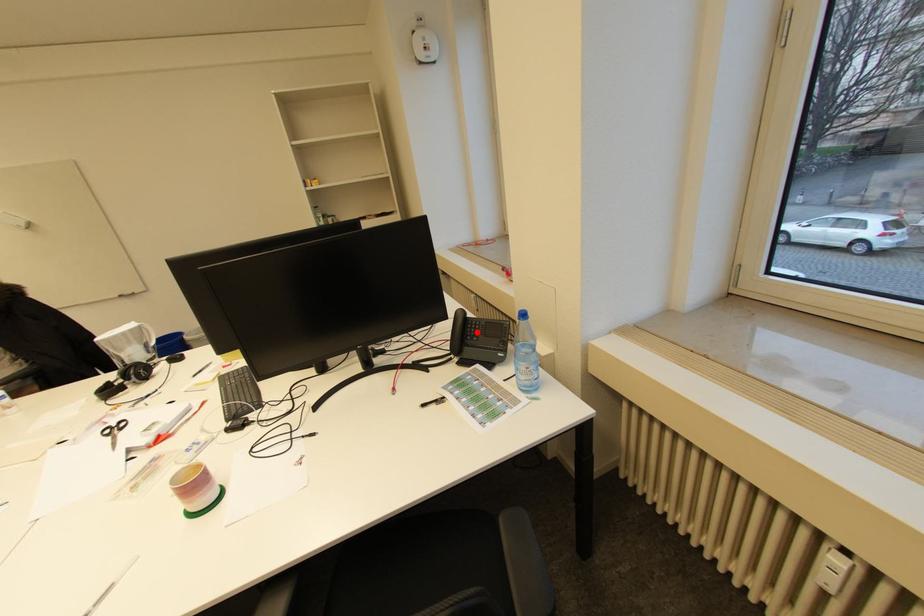
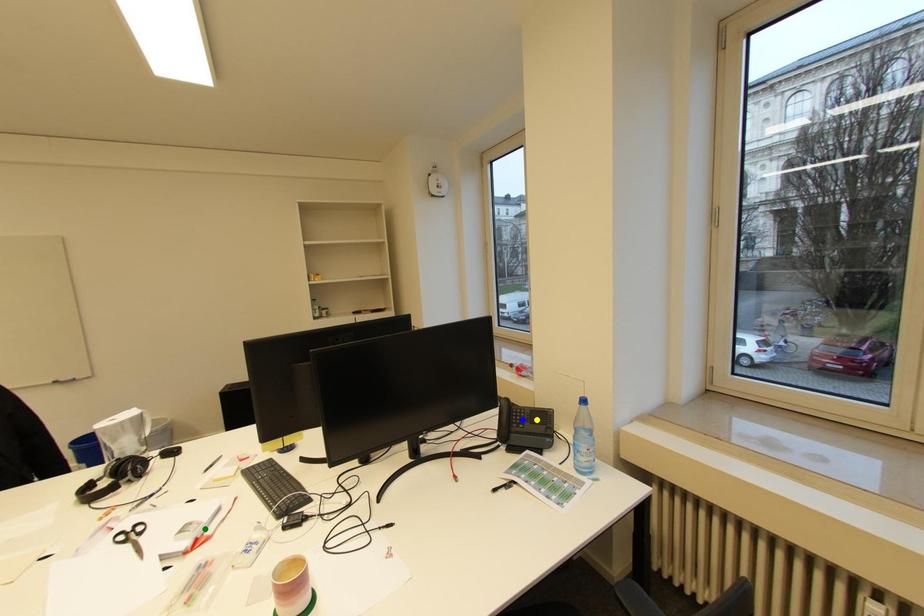
Question: I am providing you with two images of the same scene from different viewpoints. A red point is marked on the first image. You are given multiple points on the second image. In image 2, which mark is for the same physical point as the one in image 1?

Choices:
 (A) yellow point
 (B) green point
 (C) blue point

Answer: (C)